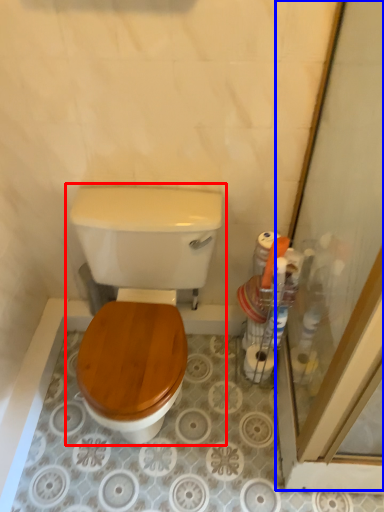
Question: Which object is further to the camera taking this photo, toilet (highlighted by a red box) or screen door (highlighted by a blue box)?

Choices:
 (A) toilet
 (B) screen door

Answer: (A)